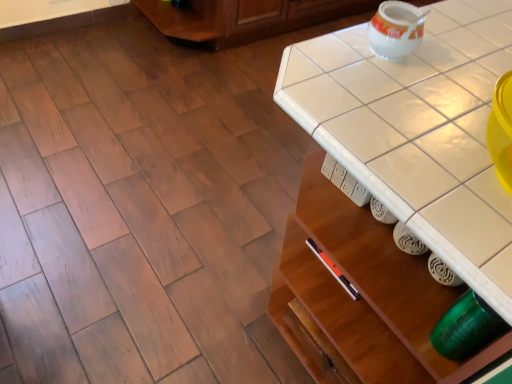
Question: From a real-world perspective, is white glossy tea pot at upper right physically located above or below white tile counter top at center?

Choices:
 (A) above
 (B) below

Answer: (A)

Question: From the image's perspective, is white glossy tea pot at upper right above or below white tile counter top at center?

Choices:
 (A) above
 (B) below

Answer: (A)

Question: Considering the positions of white glossy tea pot at upper right and white tile counter top at center in the image, is white glossy tea pot at upper right bigger or smaller than white tile counter top at center?

Choices:
 (A) big
 (B) small

Answer: (B)

Question: Is white tile counter top at center to the left or to the right of white glossy tea pot at upper right in the image?

Choices:
 (A) left
 (B) right

Answer: (B)

Question: Considering their positions, is white tile counter top at center located in front of or behind white glossy tea pot at upper right?

Choices:
 (A) behind
 (B) front

Answer: (B)

Question: From the image's perspective, is white tile counter top at center located above or below white glossy tea pot at upper right?

Choices:
 (A) below
 (B) above

Answer: (A)

Question: From a real-world perspective, is white tile counter top at center above or below white glossy tea pot at upper right?

Choices:
 (A) above
 (B) below

Answer: (B)